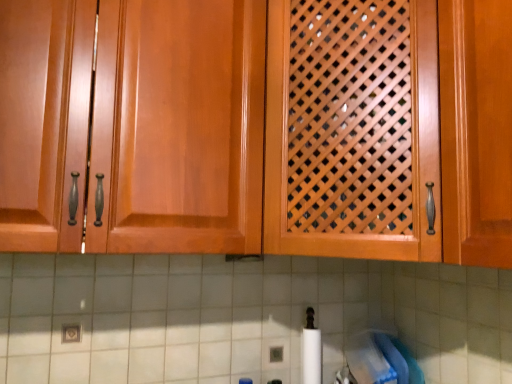
Question: From a real-world perspective, is glossy wood cabinet at center, the second cabinetry viewed from the right, beneath wooden lattice door at center, the first cabinetry positioned from the right?

Choices:
 (A) yes
 (B) no

Answer: (A)

Question: Is glossy wood cabinet at center, the second cabinetry viewed from the right, taller than wooden lattice door at center, arranged as the second cabinetry when viewed from the left?

Choices:
 (A) yes
 (B) no

Answer: (B)

Question: Can you confirm if glossy wood cabinet at center, the second cabinetry viewed from the right, is bigger than wooden lattice door at center, arranged as the second cabinetry when viewed from the left?

Choices:
 (A) no
 (B) yes

Answer: (A)

Question: Is the surface of glossy wood cabinet at center, the second cabinetry viewed from the right, in direct contact with wooden lattice door at center, arranged as the second cabinetry when viewed from the left?

Choices:
 (A) no
 (B) yes

Answer: (B)

Question: Considering the relative sizes of glossy wood cabinet at center, which ranks as the first cabinetry in left-to-right order, and wooden lattice door at center, arranged as the second cabinetry when viewed from the left, in the image provided, is glossy wood cabinet at center, which ranks as the first cabinetry in left-to-right order, wider than wooden lattice door at center, arranged as the second cabinetry when viewed from the left,?

Choices:
 (A) yes
 (B) no

Answer: (B)

Question: Is point (42, 129) positioned closer to the camera than point (78, 367)?

Choices:
 (A) closer
 (B) farther

Answer: (A)

Question: Is wooden lattice door at center, arranged as the second cabinetry when viewed from the left, taller or shorter than white tile at lower center?

Choices:
 (A) short
 (B) tall

Answer: (B)

Question: Which is correct: wooden lattice door at center, the first cabinetry positioned from the right, is inside white tile at lower center, or outside of it?

Choices:
 (A) outside
 (B) inside

Answer: (A)

Question: From the image's perspective, is wooden lattice door at center, arranged as the second cabinetry when viewed from the left, positioned above or below white tile at lower center?

Choices:
 (A) above
 (B) below

Answer: (A)

Question: Is white tile at lower center inside the boundaries of glossy wood cabinet at center, which ranks as the first cabinetry in left-to-right order, or outside?

Choices:
 (A) outside
 (B) inside

Answer: (A)

Question: Considering the positions of white tile at lower center and glossy wood cabinet at center, the second cabinetry viewed from the right, in the image, is white tile at lower center wider or thinner than glossy wood cabinet at center, the second cabinetry viewed from the right,?

Choices:
 (A) wide
 (B) thin

Answer: (B)

Question: Considering their positions, is white tile at lower center located in front of or behind glossy wood cabinet at center, the second cabinetry viewed from the right?

Choices:
 (A) behind
 (B) front

Answer: (A)

Question: From the image's perspective, relative to glossy wood cabinet at center, which ranks as the first cabinetry in left-to-right order, is white tile at lower center above or below?

Choices:
 (A) above
 (B) below

Answer: (B)

Question: Considering the relative positions of wooden lattice door at center, the first cabinetry positioned from the right, and glossy wood cabinet at center, the second cabinetry viewed from the right, in the image provided, is wooden lattice door at center, the first cabinetry positioned from the right, to the left or to the right of glossy wood cabinet at center, the second cabinetry viewed from the right,?

Choices:
 (A) left
 (B) right

Answer: (B)

Question: Is point (269, 185) closer or farther from the camera than point (90, 183)?

Choices:
 (A) closer
 (B) farther

Answer: (B)